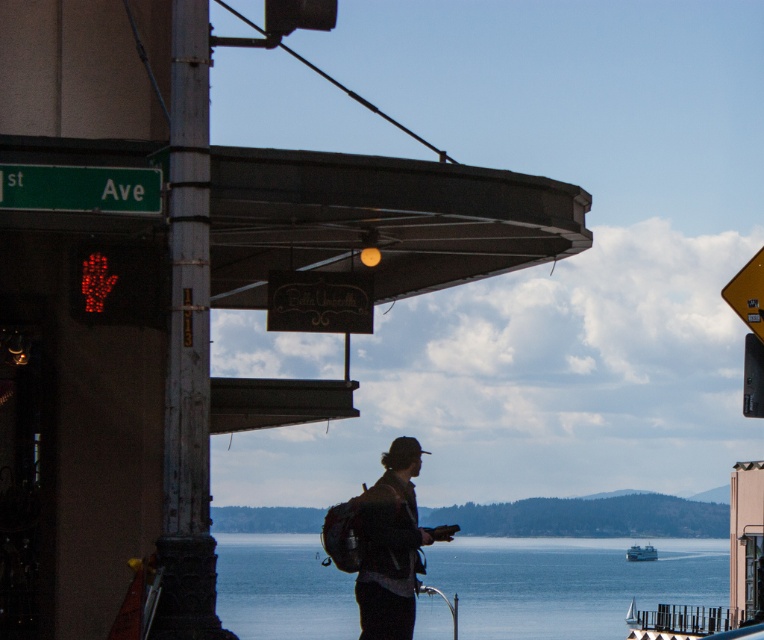
Question: Can you confirm if dark gray backpack at center is wider than green matte street sign at upper left?

Choices:
 (A) no
 (B) yes

Answer: (A)

Question: Which point is closer to the camera taking this photo?

Choices:
 (A) click(138, 320)
 (B) click(251, 304)

Answer: (A)

Question: Does black matte awning at upper center have a lesser width compared to blue water at center?

Choices:
 (A) no
 (B) yes

Answer: (B)

Question: Which is farther from the metallic rectangular at right?

Choices:
 (A) black matte awning at upper center
 (B) yellow reflective plastic traffic sign at upper right
 (C) white painted wood pole at left
 (D) dark gray backpack at center

Answer: (C)

Question: Which object appears farthest from the camera in this image?

Choices:
 (A) white painted wood pole at left
 (B) dark gray backpack at center

Answer: (B)

Question: Does blue water at center have a greater width compared to white painted wood pole at left?

Choices:
 (A) no
 (B) yes

Answer: (B)